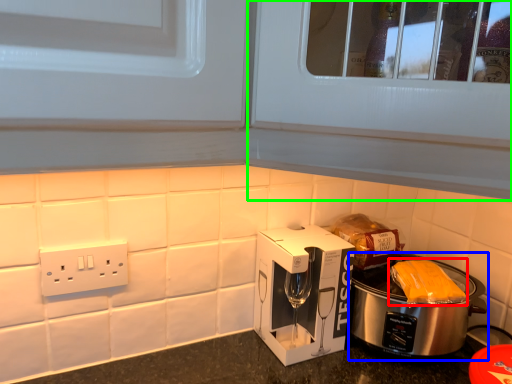
Question: Which object is positioned closest to food (highlighted by a red box)? Select from slow cooker (highlighted by a blue box) and glass door (highlighted by a green box).

Choices:
 (A) slow cooker
 (B) glass door

Answer: (A)